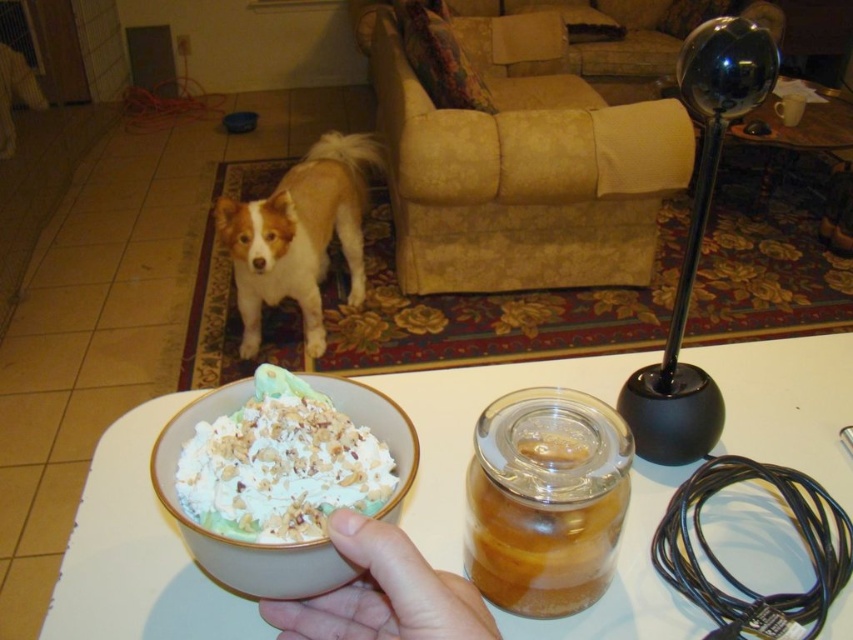
Where is `transparent glass jar at center`? This screenshot has height=640, width=853. transparent glass jar at center is located at coordinates (544, 500).

Does transparent glass jar at center have a lesser height compared to white textured bowl at lower left?

No, transparent glass jar at center is not shorter than white textured bowl at lower left.

Does point (558, 394) come closer to viewer compared to point (177, 515)?

No, (558, 394) is behind (177, 515).

Identify the location of transparent glass jar at center. This screenshot has width=853, height=640. (544, 500).

Does white textured bowl at lower left lie in front of flesh-toned skin at center?

That is False.

Does point (163, 442) come in front of point (347, 531)?

That is False.

Find the location of a particular element. The width and height of the screenshot is (853, 640). white textured bowl at lower left is located at coordinates (236, 540).

Is the position of white ceramic bowl at center less distant than that of transparent glass jar at center?

No, white ceramic bowl at center is behind transparent glass jar at center.

Looking at this image, is white ceramic bowl at center above transparent glass jar at center?

Correct, white ceramic bowl at center is located above transparent glass jar at center.

Is point (808, 451) positioned in front of point (474, 481)?

No, (808, 451) is further to viewer.

Find the location of a particular element. The height and width of the screenshot is (640, 853). white ceramic bowl at center is located at coordinates (137, 554).